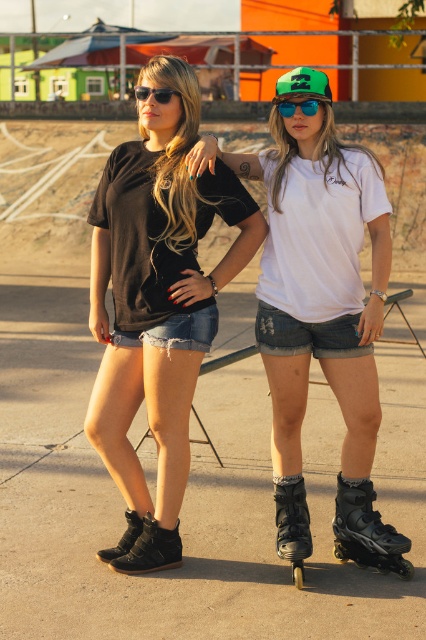
Question: Does black suede booties at center have a lesser width compared to black matte roller skate at lower right?

Choices:
 (A) no
 (B) yes

Answer: (A)

Question: Which point is closer to the camera?

Choices:
 (A) black suede booties at center
 (B) black rubber roller skate at lower center
 (C) blue reflective lens goggles at center
 (D) white matte t-shirt at center

Answer: (D)

Question: Among these objects, which one is farthest from the camera?

Choices:
 (A) white matte t-shirt at center
 (B) black suede booties at center
 (C) blue reflective lens goggles at center

Answer: (C)

Question: Does white matte t-shirt at center appear over black rubber roller skate at lower center?

Choices:
 (A) no
 (B) yes

Answer: (B)

Question: Is black matte roller skate at lower right behind blue reflective lens goggles at center?

Choices:
 (A) yes
 (B) no

Answer: (A)

Question: Which point is closer to the camera?

Choices:
 (A) blue reflective lens goggles at center
 (B) black suede booties at center
 (C) black rubber roller skate at lower center

Answer: (B)